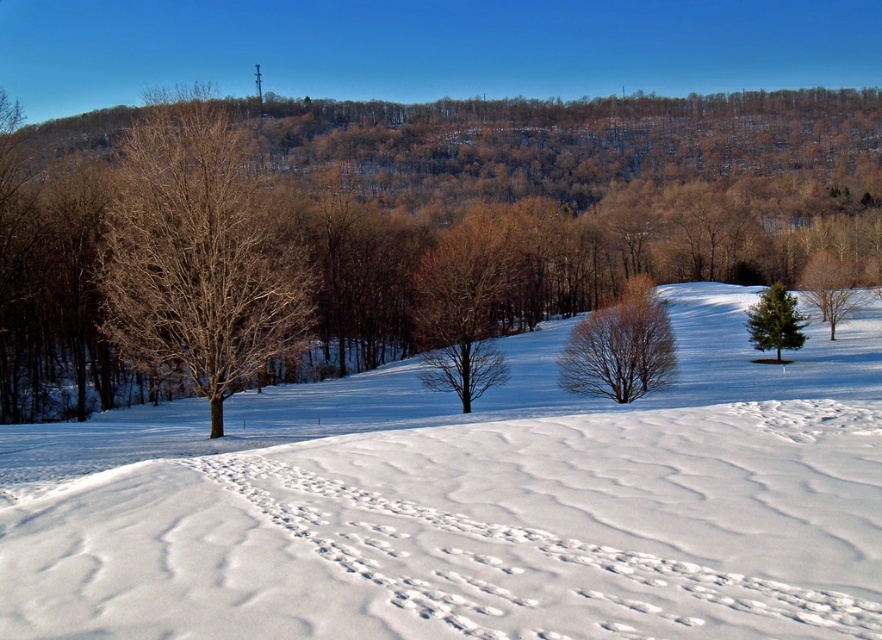
Question: Which point appears farthest from the camera in this image?

Choices:
 (A) (285, 308)
 (B) (833, 307)

Answer: (B)

Question: Where is brown textured tree at center located in relation to green leafy tree at center right in the image?

Choices:
 (A) right
 (B) left

Answer: (B)

Question: Is bare brown tree at center thinner than green textured pine tree at right?

Choices:
 (A) yes
 (B) no

Answer: (B)

Question: Which object is positioned farthest from the brown textured tree at center?

Choices:
 (A) white snow at center
 (B) bare brown tree at center

Answer: (B)

Question: Observing the image, what is the correct spatial positioning of bare brown tree at center in reference to green textured pine tree at right?

Choices:
 (A) left
 (B) right

Answer: (A)

Question: Which object is the farthest from the green textured pine tree at right?

Choices:
 (A) green leafy tree at center right
 (B) brown textured tree at center

Answer: (B)